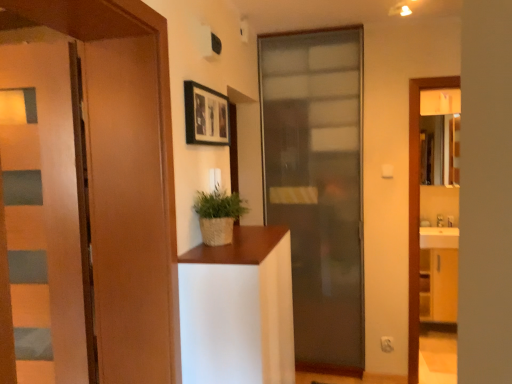
This screenshot has height=384, width=512. What are the coordinates of `vacant region to the right of braided straw pot at center` in the screenshot? It's located at (262, 244).